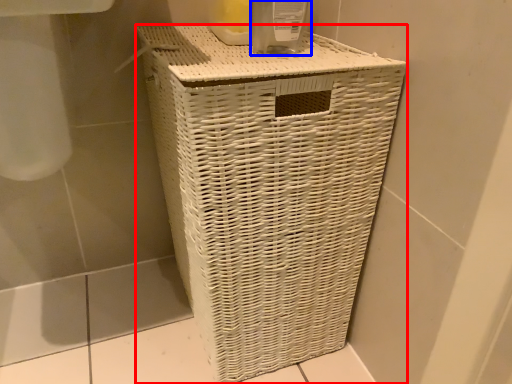
Question: Which point is closer to the camera, waste container (highlighted by a red box) or glass jar (highlighted by a blue box)?

Choices:
 (A) waste container
 (B) glass jar

Answer: (A)